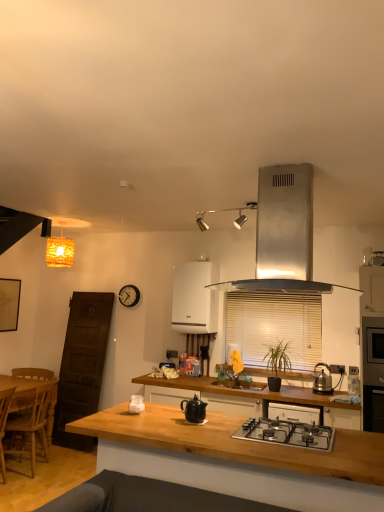
The image size is (384, 512). In order to click on vacant space to the right of white glossy jar at center, the 4th kitchen appliance in the top-to-bottom sequence in this screenshot , I will do `click(168, 413)`.